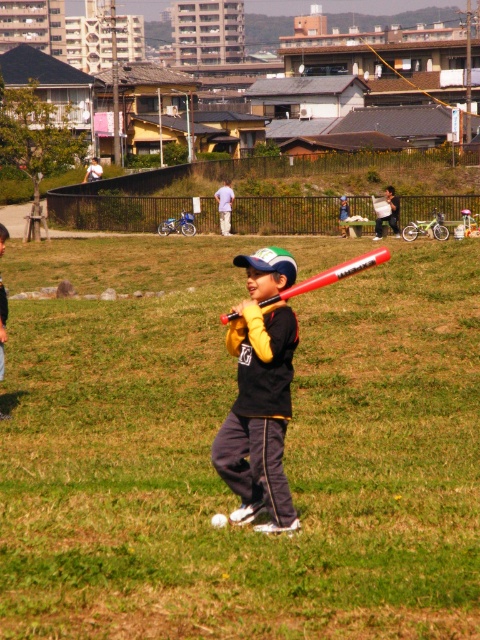
Question: Is rubberized red bat at center bigger than white fuzzy baseball at center?

Choices:
 (A) no
 (B) yes

Answer: (B)

Question: Among these objects, which one is farthest from the camera?

Choices:
 (A) matte black baseball bat at center
 (B) rubberized red bat at center
 (C) white fuzzy baseball at center

Answer: (C)

Question: Can you confirm if rubberized red bat at center is positioned to the right of white fuzzy baseball at center?

Choices:
 (A) yes
 (B) no

Answer: (A)

Question: Among these objects, which one is farthest from the camera?

Choices:
 (A) rubberized red bat at center
 (B) white fuzzy baseball at center

Answer: (B)

Question: Is the position of matte black baseball bat at center less distant than that of white fuzzy baseball at center?

Choices:
 (A) no
 (B) yes

Answer: (B)

Question: Which point is closer to the camera taking this photo?

Choices:
 (A) (216, 522)
 (B) (268, 467)
 (C) (374, 252)

Answer: (B)